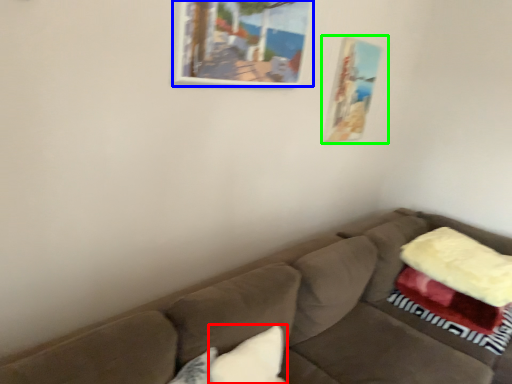
Question: Which object is positioned farthest from pillow (highlighted by a red box)? Select from picture frame (highlighted by a blue box) and picture frame (highlighted by a green box).

Choices:
 (A) picture frame
 (B) picture frame

Answer: (B)